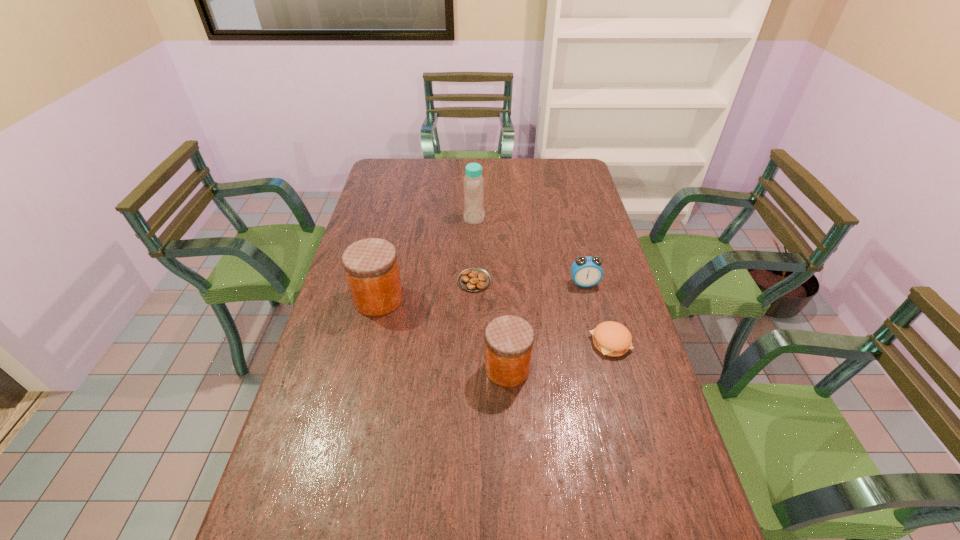
Please point a spot to add another jar on the right. Please provide its 2D coordinates. Your answer should be formatted as a tuple, i.e. [(x, y)], where the tuple contains the x and y coordinates of a point satisfying the conditions above.

[(685, 464)]